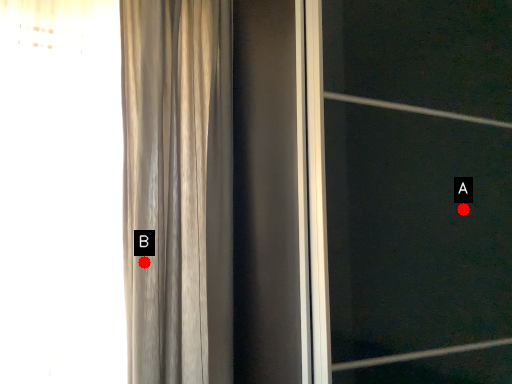
Question: Two points are circled on the image, labeled by A and B beside each circle. Which point appears farthest from the camera in this image?

Choices:
 (A) A is further
 (B) B is further

Answer: (B)